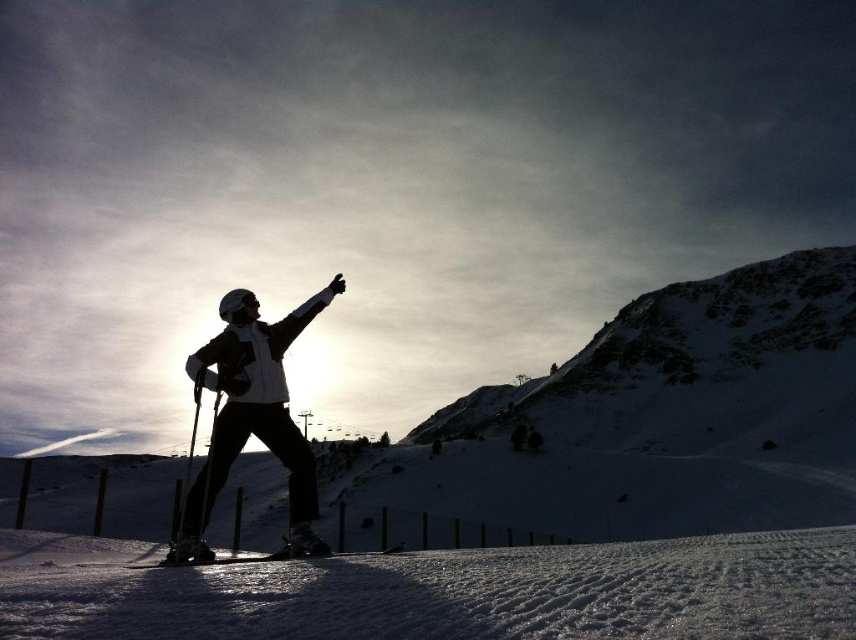
Does white snow at lower center have a lesser width compared to shiny metallic ski at center?

Incorrect, white snow at lower center's width is not less than shiny metallic ski at center's.

Between white snow at lower center and shiny metallic ski at center, which one appears on the left side from the viewer's perspective?

shiny metallic ski at center

Is point (823, 596) in front of point (220, 563)?

Yes.

This screenshot has height=640, width=856. Identify the location of white snow at lower center. (455, 593).

From the picture: Between matte white jacket at center and shiny metallic ski at center, which one has less height?

Standing shorter between the two is shiny metallic ski at center.

Can you confirm if matte white jacket at center is taller than shiny metallic ski at center?

Yes.

This screenshot has height=640, width=856. What do you see at coordinates (253, 416) in the screenshot?
I see `matte white jacket at center` at bounding box center [253, 416].

I want to click on matte white jacket at center, so click(x=253, y=416).

Which is behind, point (584, 588) or point (224, 460)?

The point (224, 460) is more distant.

Is point (0, 604) positioned behind point (251, 417)?

No, it is not.

At what (x,y) coordinates should I click in order to perform the action: click on white snow at lower center. Please return your answer as a coordinate pair (x, y). The width and height of the screenshot is (856, 640). Looking at the image, I should click on (455, 593).

In order to click on white snow at lower center in this screenshot , I will do `click(455, 593)`.